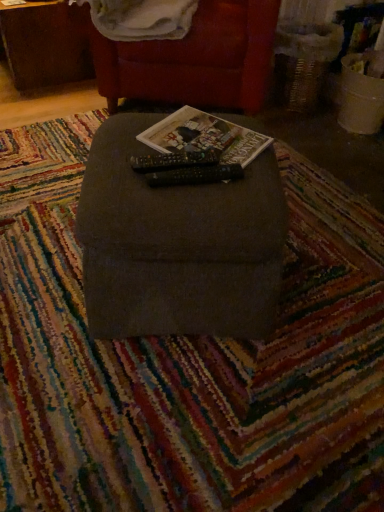
At what (x,y) coordinates should I click in order to perform the action: click on free spot above matte paper magazine at center (from a real-world perspective). Please return your answer as a coordinate pair (x, y). Looking at the image, I should click on (209, 133).